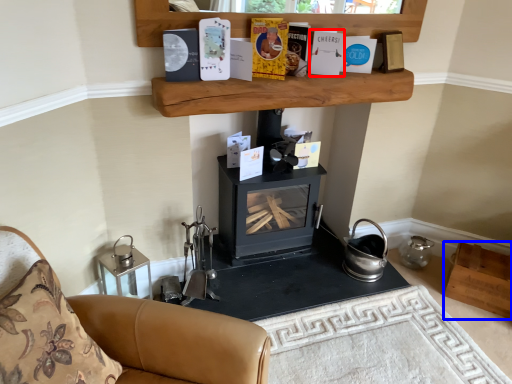
Question: Which of the following is the farthest to the observer, paperback book (highlighted by a red box) or shelf (highlighted by a blue box)?

Choices:
 (A) paperback book
 (B) shelf

Answer: (B)